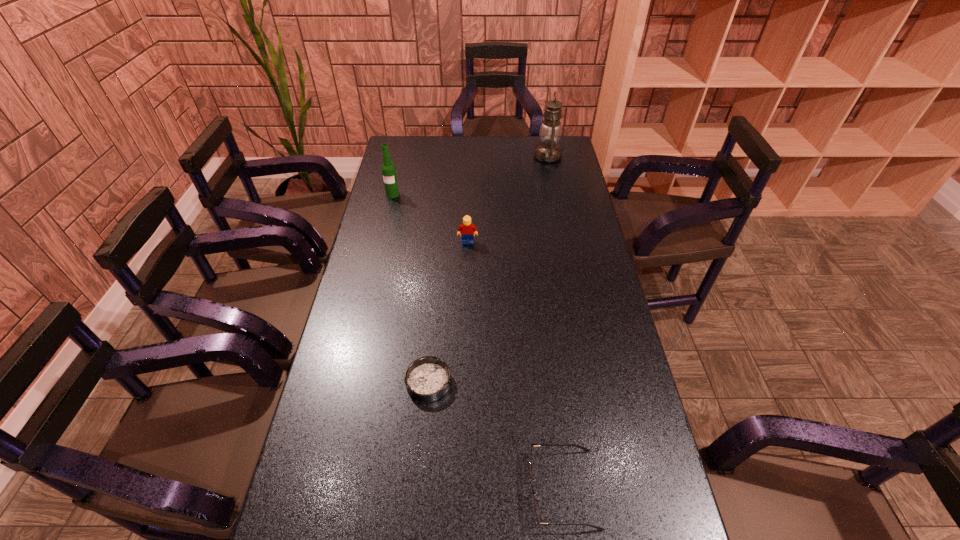
Where is `spectacles present at the right edge`? This screenshot has width=960, height=540. spectacles present at the right edge is located at coordinates (583, 448).

The height and width of the screenshot is (540, 960). What are the coordinates of `object that is at the far right corner` in the screenshot? It's located at (548, 150).

At what (x,y) coordinates should I click in order to perform the action: click on free location at the far edge. Please return your answer as a coordinate pair (x, y). The image size is (960, 540). Looking at the image, I should click on (500, 160).

This screenshot has height=540, width=960. Identify the location of free point at the left edge. (412, 207).

Where is `free space at the right edge of the desktop`? free space at the right edge of the desktop is located at coordinates (560, 214).

Locate an element on the screen. The image size is (960, 540). free space at the far left corner of the desktop is located at coordinates (408, 161).

At what (x,y) coordinates should I click in order to perform the action: click on unoccupied area between the beer bottle and the third nearest object. Please return your answer as a coordinate pair (x, y). The width and height of the screenshot is (960, 540). Looking at the image, I should click on (430, 218).

Where is `unoccupied area between the tallest object and the shortest object`? This screenshot has height=540, width=960. unoccupied area between the tallest object and the shortest object is located at coordinates (x=489, y=269).

At what (x,y) coordinates should I click in order to perform the action: click on vacant point located between the ashtray and the leftmost object. Please return your answer as a coordinate pair (x, y). The height and width of the screenshot is (540, 960). Looking at the image, I should click on (411, 288).

Locate an element on the screen. vacant area that lies between the second shortest object and the ashtray is located at coordinates (495, 435).